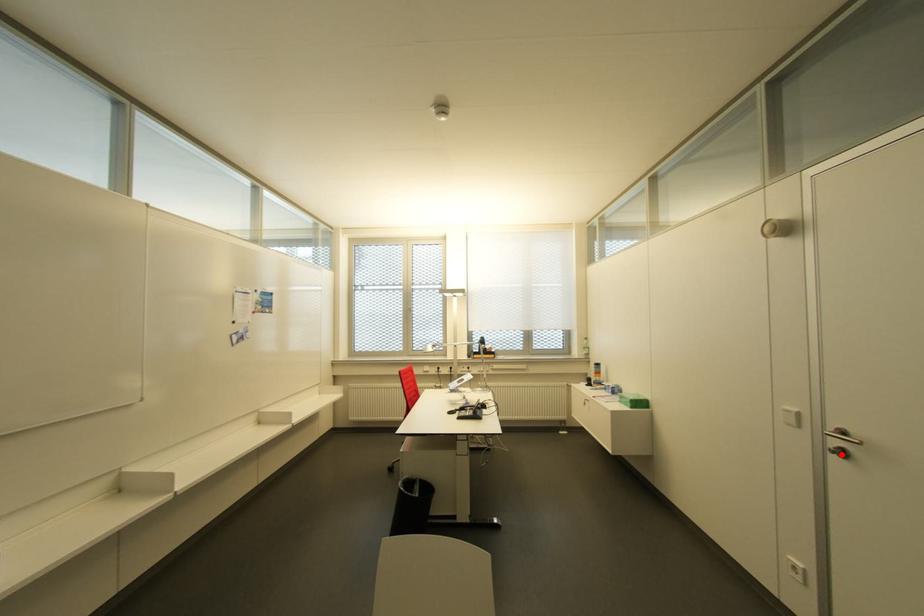
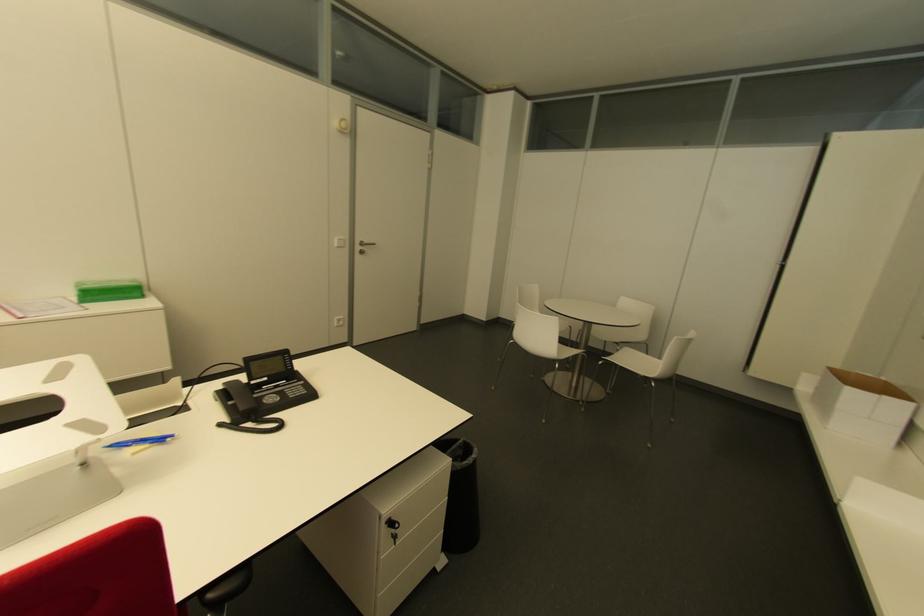
Question: I am providing you with two images of the same scene from different viewpoints. In image1, a red point is highlighted. Considering the same 3D point in image2, which of the following is correct?

Choices:
 (A) It is closer
 (B) It is farther

Answer: (A)